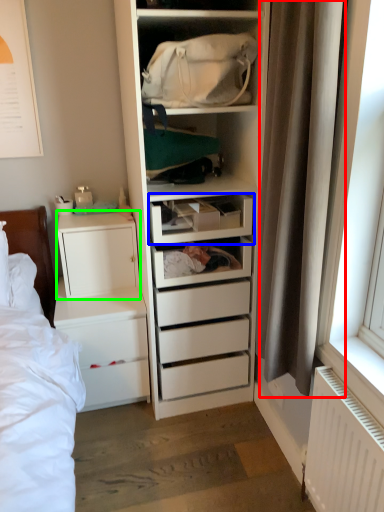
Question: Estimate the real-world distances between objects in this image. Which object is farther from curtain (highlighted by a red box), drawer (highlighted by a blue box) or cabinetry (highlighted by a green box)?

Choices:
 (A) drawer
 (B) cabinetry

Answer: (B)